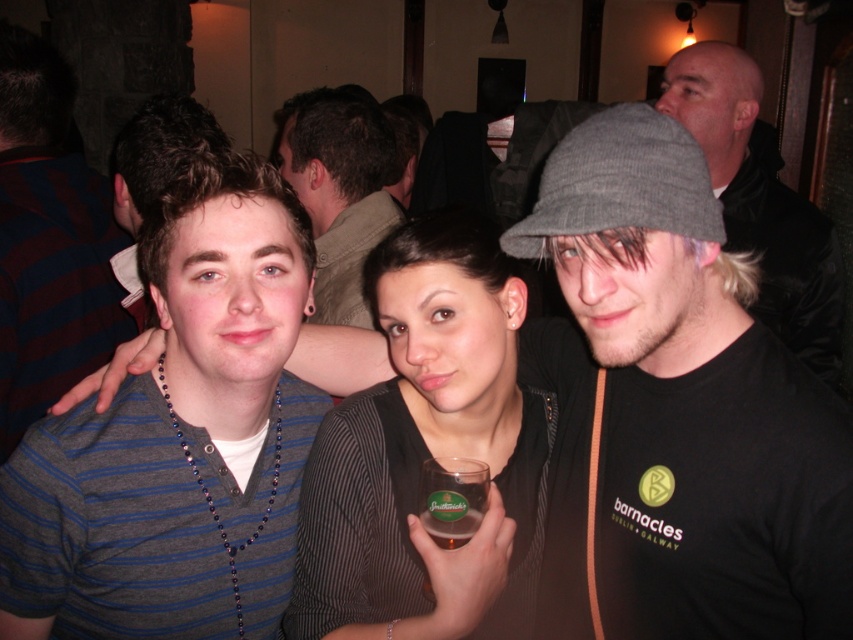
You are a photographer adjusting your camera focus. You want to ensure that both the black matte hat at upper right and the striped cotton shirt at center are in sharp focus. Based on their positions, which object should you focus on first to achieve this?

The black matte hat at upper right is in front of the striped cotton shirt at center, so you should focus on the black matte hat at upper right first to ensure both are in sharp focus.

You are a photographer trying to frame a shot that includes both the black matte hat at upper right and the matte brown shirt at center. Which object should you adjust your camera angle to prioritize if you want to focus on the wider one?

The matte brown shirt at center has a greater width than the black matte hat at upper right, so you should prioritize focusing on the matte brown shirt at center.

You are at a bar and want to order a drink. You notice two shirts in the scene. The striped shirt at center and the striped cotton shirt at left. Which shirt is closer to the bar counter?

The striped shirt at center is located below the striped cotton shirt at left, which means it is closer to the bar counter since it is positioned lower in the image.